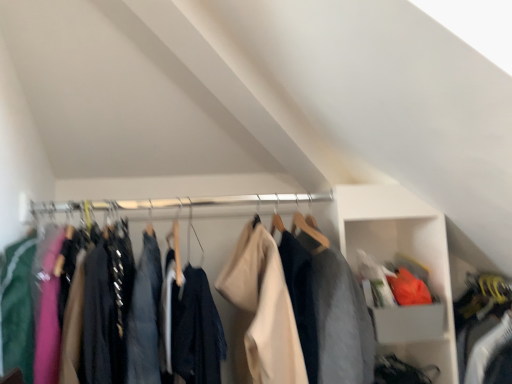
Where is `white plastic cabinet at upper right`? The height and width of the screenshot is (384, 512). white plastic cabinet at upper right is located at coordinates click(410, 257).

What do you see at coordinates (410, 257) in the screenshot? I see `white plastic cabinet at upper right` at bounding box center [410, 257].

Image resolution: width=512 pixels, height=384 pixels. I want to click on matte black jacket at center, so click(344, 321).

The image size is (512, 384). Describe the element at coordinates (344, 321) in the screenshot. I see `matte black jacket at center` at that location.

Measure the distance between point (341, 264) and camera.

Point (341, 264) is 4.34 feet from camera.

Measure the distance between matte black jacket at center and camera.

matte black jacket at center is 1.21 meters away from camera.

I want to click on white plastic cabinet at upper right, so click(x=410, y=257).

Is white plastic cabinet at upper right to the right of matte black jacket at center from the viewer's perspective?

Yes.

In the image, is white plastic cabinet at upper right positioned in front of or behind matte black jacket at center?

Clearly, white plastic cabinet at upper right is behind matte black jacket at center.

Is point (388, 186) closer to viewer compared to point (340, 334)?

No, (388, 186) is behind (340, 334).

From the image's perspective, is white plastic cabinet at upper right under matte black jacket at center?

Yes, from the image's perspective, white plastic cabinet at upper right is below matte black jacket at center.

From a real-world perspective, is white plastic cabinet at upper right physically located above or below matte black jacket at center?

In terms of real-world spatial position, white plastic cabinet at upper right is below matte black jacket at center.

Looking at this image, is white plastic cabinet at upper right thinner than matte black jacket at center?

Yes, white plastic cabinet at upper right is thinner than matte black jacket at center.

Considering the sizes of objects white plastic cabinet at upper right and matte black jacket at center in the image provided, who is shorter, white plastic cabinet at upper right or matte black jacket at center?

Standing shorter between the two is matte black jacket at center.

Which of these two, white plastic cabinet at upper right or matte black jacket at center, is smaller?

With smaller size is white plastic cabinet at upper right.

Is white plastic cabinet at upper right not within matte black jacket at center?

Yes.

Is white plastic cabinet at upper right next to matte black jacket at center and touching it?

white plastic cabinet at upper right and matte black jacket at center are not in contact.

Is white plastic cabinet at upper right turned away from matte black jacket at center?

No, white plastic cabinet at upper right's orientation is not away from matte black jacket at center.

How different are the orientations of white plastic cabinet at upper right and matte black jacket at center in degrees?

white plastic cabinet at upper right and matte black jacket at center are facing 0.2 degrees away from each other.

Where is `clothing above the white plastic cabinet at upper right (from the image's perspective)`? clothing above the white plastic cabinet at upper right (from the image's perspective) is located at coordinates (344, 321).

Does matte black jacket at center appear on the left side of white plastic cabinet at upper right?

Indeed, matte black jacket at center is positioned on the left side of white plastic cabinet at upper right.

Is matte black jacket at center positioned behind white plastic cabinet at upper right?

No.

Which is less distant, (218, 381) or (365, 239)?

The point (218, 381) is more forward.

From the image's perspective, is matte black jacket at center beneath white plastic cabinet at upper right?

No.

From a real-world perspective, is matte black jacket at center on top of white plastic cabinet at upper right?

Yes, from a real-world perspective, matte black jacket at center is over white plastic cabinet at upper right

Which object is thinner, matte black jacket at center or white plastic cabinet at upper right?

With smaller width is white plastic cabinet at upper right.

Considering the relative sizes of matte black jacket at center and white plastic cabinet at upper right in the image provided, is matte black jacket at center taller than white plastic cabinet at upper right?

No, matte black jacket at center is not taller than white plastic cabinet at upper right.

Considering the sizes of matte black jacket at center and white plastic cabinet at upper right in the image, is matte black jacket at center bigger or smaller than white plastic cabinet at upper right?

Clearly, matte black jacket at center is larger in size than white plastic cabinet at upper right.

Is matte black jacket at center not within white plastic cabinet at upper right?

Indeed, matte black jacket at center is completely outside white plastic cabinet at upper right.

Is there a large distance between matte black jacket at center and white plastic cabinet at upper right?

They are positioned close to each other.

Is matte black jacket at center aimed at white plastic cabinet at upper right?

No, matte black jacket at center is not facing towards white plastic cabinet at upper right.

How distant is matte black jacket at center from white plastic cabinet at upper right?

matte black jacket at center is 12.47 inches from white plastic cabinet at upper right.

This screenshot has height=384, width=512. I want to click on cabinet behind the matte black jacket at center, so click(x=410, y=257).

The image size is (512, 384). What are the coordinates of `clothing in front of the white plastic cabinet at upper right` in the screenshot? It's located at (344, 321).

I want to click on cabinet behind the matte black jacket at center, so click(410, 257).